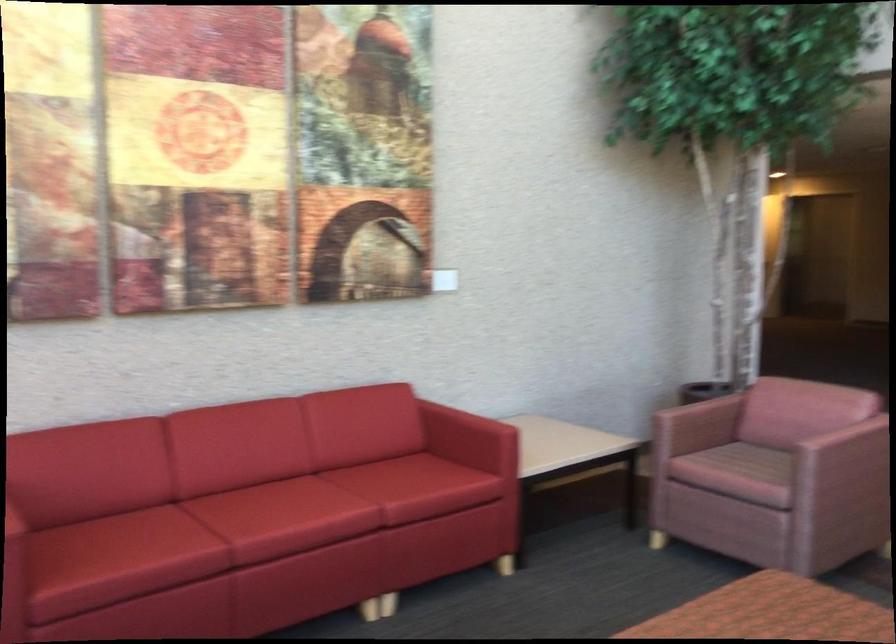
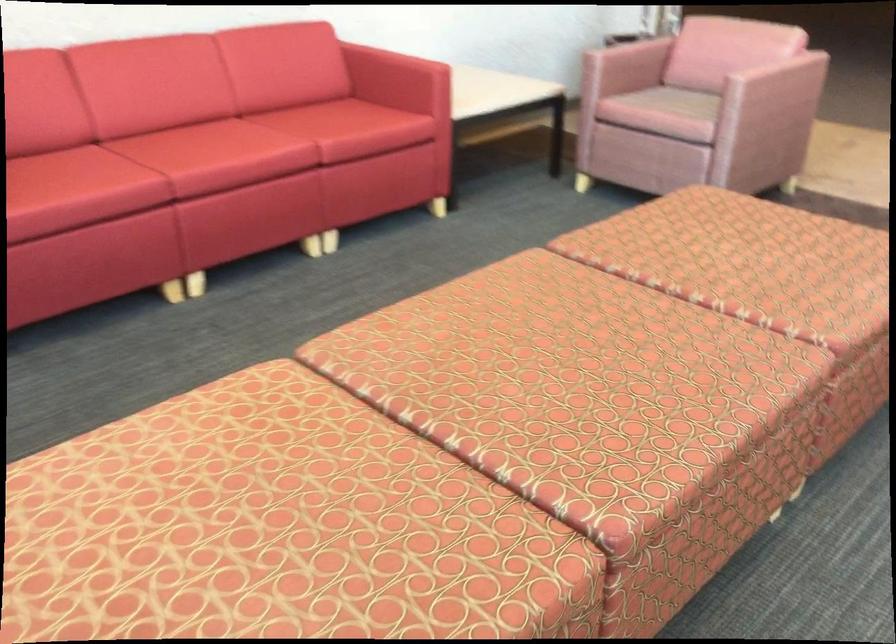
Question: Which direction would the cameraman need to move to produce the second image? Reply with the corresponding letter.

Choices:
 (A) Left
 (B) Right
 (C) Forward
 (D) Backward

Answer: (A)